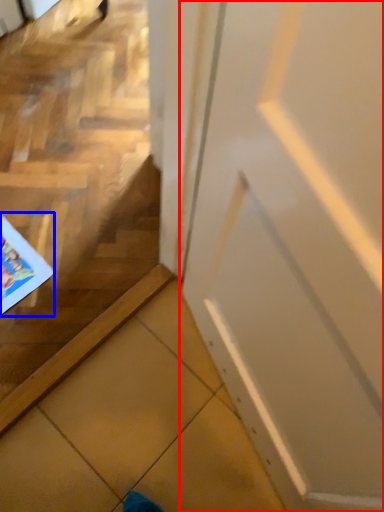
Question: Which object appears closest to the camera in this image, door (highlighted by a red box) or comic book (highlighted by a blue box)?

Choices:
 (A) door
 (B) comic book

Answer: (A)